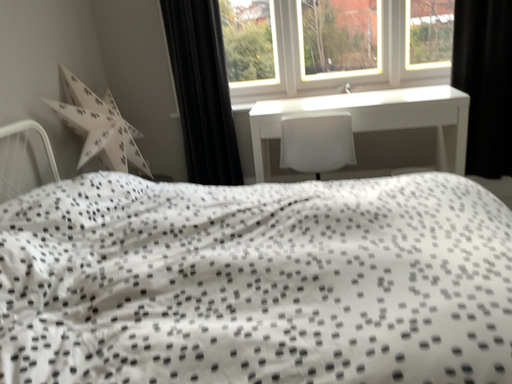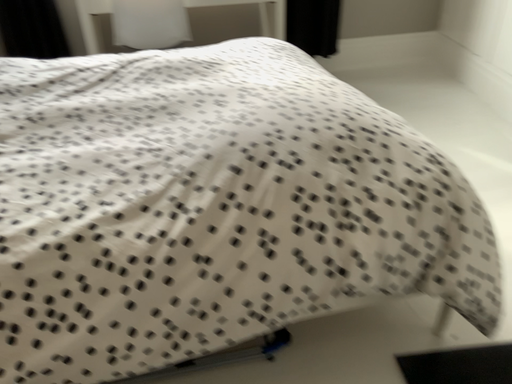
Question: Which way did the camera rotate in the video?

Choices:
 (A) rotated left
 (B) rotated right

Answer: (B)